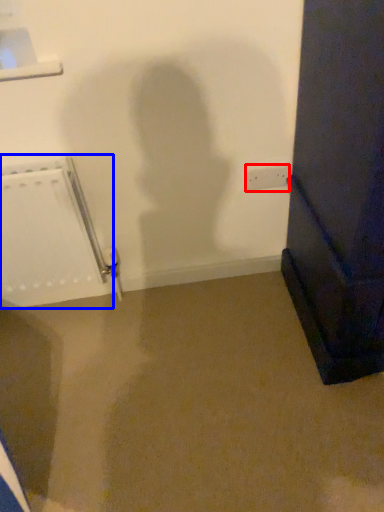
Question: Which point is further to the camera, electric outlet (highlighted by a red box) or radiator (highlighted by a blue box)?

Choices:
 (A) electric outlet
 (B) radiator

Answer: (A)